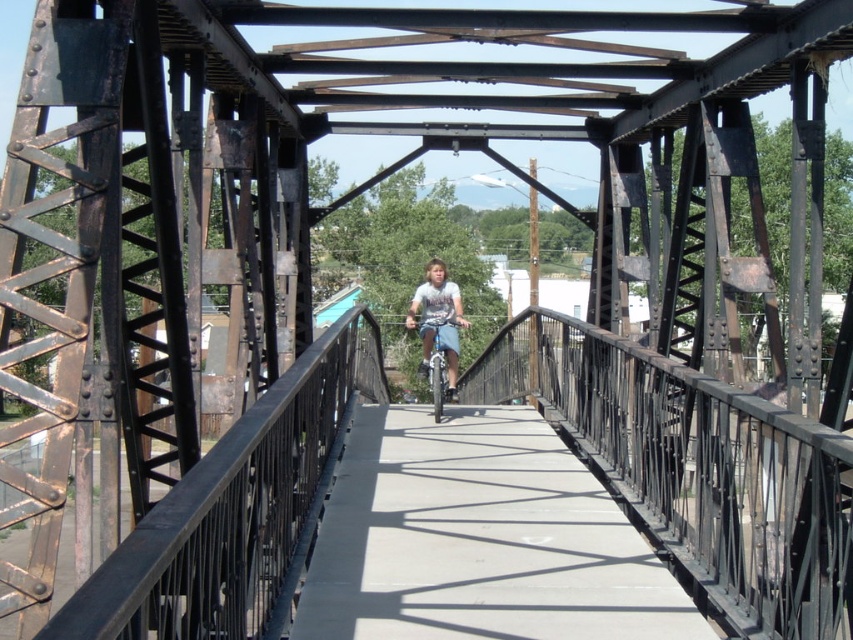
Question: Is white concrete path at center to the left of light blue denim shorts at center from the viewer's perspective?

Choices:
 (A) no
 (B) yes

Answer: (A)

Question: Which point appears farthest from the camera in this image?

Choices:
 (A) (494, 563)
 (B) (422, 321)

Answer: (B)

Question: In this image, where is white concrete path at center located relative to light blue denim shorts at center?

Choices:
 (A) left
 (B) right

Answer: (B)

Question: Among these objects, which one is farthest from the camera?

Choices:
 (A) light blue denim shorts at center
 (B) white concrete path at center

Answer: (A)

Question: Does white concrete path at center appear on the left side of light blue denim shorts at center?

Choices:
 (A) no
 (B) yes

Answer: (A)